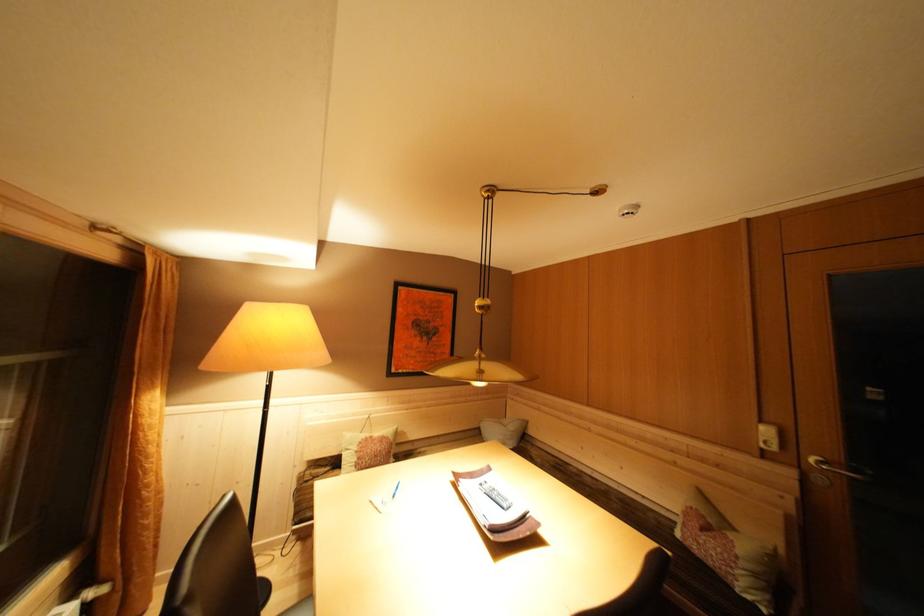
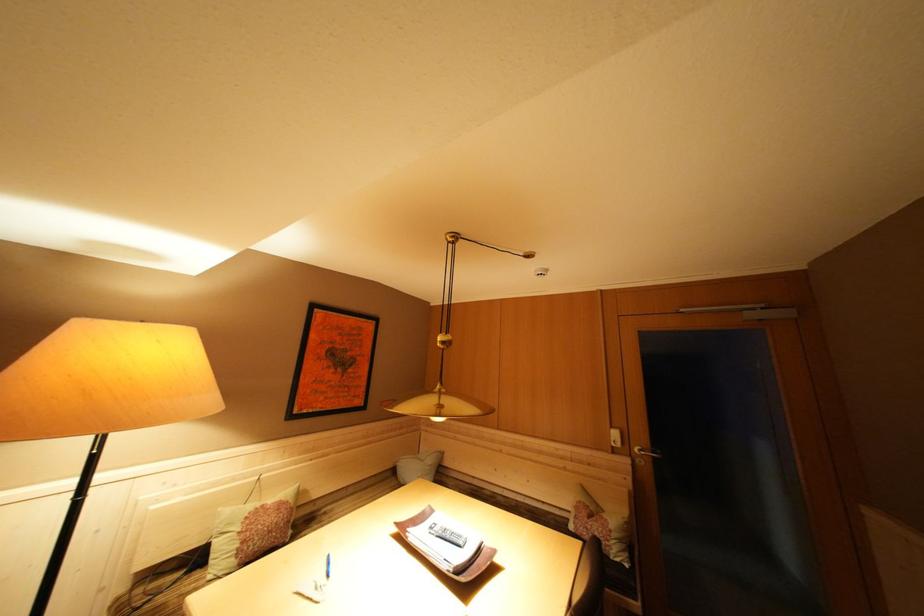
Question: Based on the continuous images, in which direction is the camera rotating? Reply with the corresponding letter.

Choices:
 (A) Left
 (B) Right
 (C) Up
 (D) Down

Answer: (B)